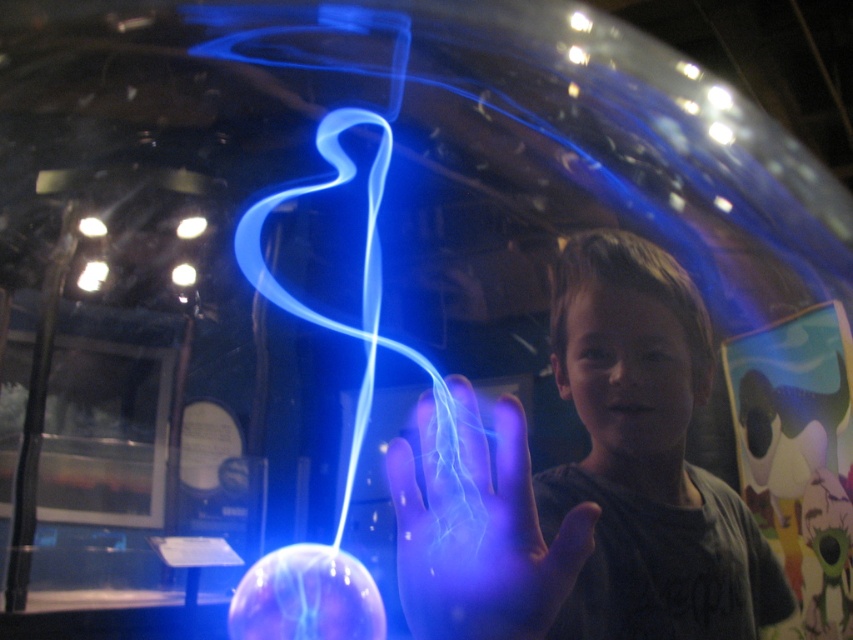
You are a visitor in the science museum and want to touch both the matte black shirt at center and the translucent glass sphere at center. Given that you can only move forward or backward, which object will you reach first?

The matte black shirt at center is 2.45 meters away from the translucent glass sphere at center. Since you can only move forward or backward, you will reach the closer object first. However, since both objects are at the center, their distance from you depends on your starting position. Without knowing your exact position, it is impossible to determine which one you will reach first.

You are a photographer trying to capture a clear photo of the matte black shirt at center. You are holding a camera that has a minimum focusing distance of 18 inches. Can you take the photo without moving closer?

The matte black shirt at center and camera are 17.13 inches apart from each other. Since the minimum focusing distance is 18 inches, the camera cannot focus properly at this distance. Move slightly back to ensure the subject is within the focus range.